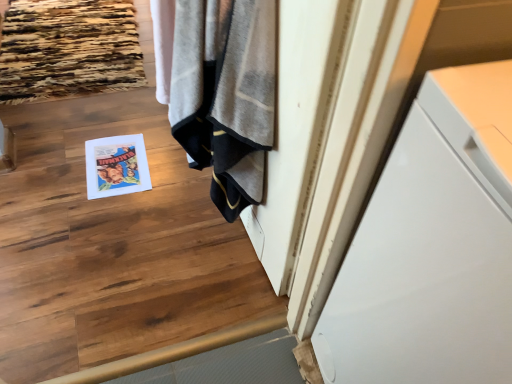
Question: Is white glossy cabinet at right oriented away from gray textured towel at center?

Choices:
 (A) yes
 (B) no

Answer: (B)

Question: From a real-world perspective, is white glossy cabinet at right physically below gray textured towel at center?

Choices:
 (A) no
 (B) yes

Answer: (B)

Question: Does white glossy cabinet at right have a larger size compared to gray textured towel at center?

Choices:
 (A) yes
 (B) no

Answer: (A)

Question: Does white glossy cabinet at right have a greater width compared to gray textured towel at center?

Choices:
 (A) no
 (B) yes

Answer: (B)

Question: Is gray textured towel at center surrounded by white glossy cabinet at right?

Choices:
 (A) no
 (B) yes

Answer: (A)

Question: Is the position of white glossy cabinet at right more distant than that of gray textured towel at center?

Choices:
 (A) no
 (B) yes

Answer: (A)

Question: Can you confirm if white glossy cabinet at right is bigger than matte paper magazine at center?

Choices:
 (A) no
 (B) yes

Answer: (B)

Question: From the image's perspective, is white glossy cabinet at right over matte paper magazine at center?

Choices:
 (A) yes
 (B) no

Answer: (B)

Question: From a real-world perspective, is white glossy cabinet at right physically below matte paper magazine at center?

Choices:
 (A) yes
 (B) no

Answer: (B)

Question: Considering the relative sizes of white glossy cabinet at right and matte paper magazine at center in the image provided, is white glossy cabinet at right wider than matte paper magazine at center?

Choices:
 (A) yes
 (B) no

Answer: (A)

Question: Does white glossy cabinet at right appear on the left side of matte paper magazine at center?

Choices:
 (A) no
 (B) yes

Answer: (A)

Question: Is white glossy cabinet at right looking in the opposite direction of matte paper magazine at center?

Choices:
 (A) yes
 (B) no

Answer: (B)

Question: Does gray textured towel at center have a larger size compared to matte paper magazine at center?

Choices:
 (A) no
 (B) yes

Answer: (B)